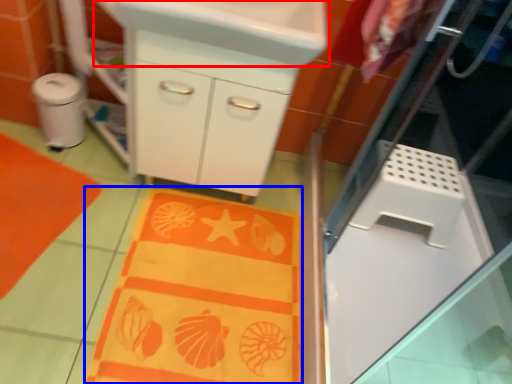
Question: Among these objects, which one is nearest to the camera, sink (highlighted by a red box) or blanket (highlighted by a blue box)?

Choices:
 (A) sink
 (B) blanket

Answer: (A)